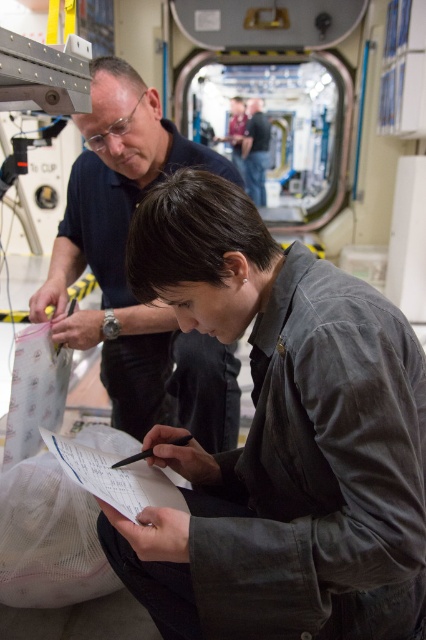
Question: Is dark gray uniform at center above white paper at center?

Choices:
 (A) yes
 (B) no

Answer: (A)

Question: Considering the real-world distances, which object is closest to the dark blue shirt at center?

Choices:
 (A) dark gray uniform at center
 (B) dark blue shirt at upper left
 (C) white paper at center
 (D) black pen at lower center

Answer: (B)

Question: Considering the real-world distances, which object is farthest from the white paper at center?

Choices:
 (A) dark gray uniform at center
 (B) black pen at lower center
 (C) dark blue shirt at center

Answer: (C)

Question: Which object is the closest to the dark blue shirt at center?

Choices:
 (A) white paper at center
 (B) dark gray uniform at center
 (C) black pen at lower center

Answer: (A)

Question: Does dark gray uniform at center have a greater width compared to white paper at center?

Choices:
 (A) no
 (B) yes

Answer: (B)

Question: Does dark blue shirt at upper left appear on the right side of black pen at lower center?

Choices:
 (A) yes
 (B) no

Answer: (B)